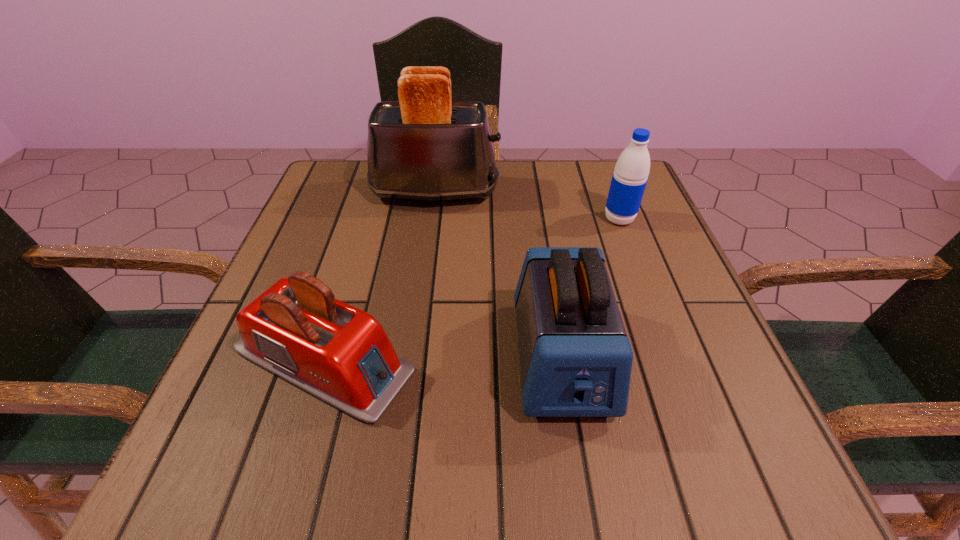
Find the location of `the farthest toaster`. the farthest toaster is located at coordinates (426, 147).

The width and height of the screenshot is (960, 540). Find the location of `the tallest toaster`. the tallest toaster is located at coordinates (426, 147).

At what (x,y) coordinates should I click in order to perform the action: click on water bottle. Please return your answer as a coordinate pair (x, y). Image resolution: width=960 pixels, height=540 pixels. Looking at the image, I should click on (630, 176).

Image resolution: width=960 pixels, height=540 pixels. I want to click on the rightmost toaster, so click(x=575, y=357).

This screenshot has height=540, width=960. Identify the location of the shortest object. (296, 329).

This screenshot has width=960, height=540. Find the location of `vacant area located on the side of the farthest toaster with the control lever`. vacant area located on the side of the farthest toaster with the control lever is located at coordinates (587, 192).

Locate an element on the screen. free space located 0.300m on the left of the water bottle is located at coordinates (469, 219).

Locate an element on the screen. The image size is (960, 540). free space located on the front-facing side of the rightmost toaster is located at coordinates (581, 477).

In order to click on free space located 0.250m on the back of the shortest toaster in this screenshot , I will do `click(365, 224)`.

The height and width of the screenshot is (540, 960). In order to click on toaster that is positioned at the far edge in this screenshot , I will do `click(426, 147)`.